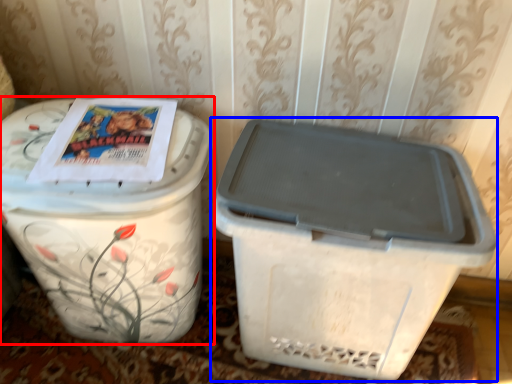
Question: Which object appears closest to the camera in this image, waste container (highlighted by a red box) or waste container (highlighted by a blue box)?

Choices:
 (A) waste container
 (B) waste container

Answer: (A)